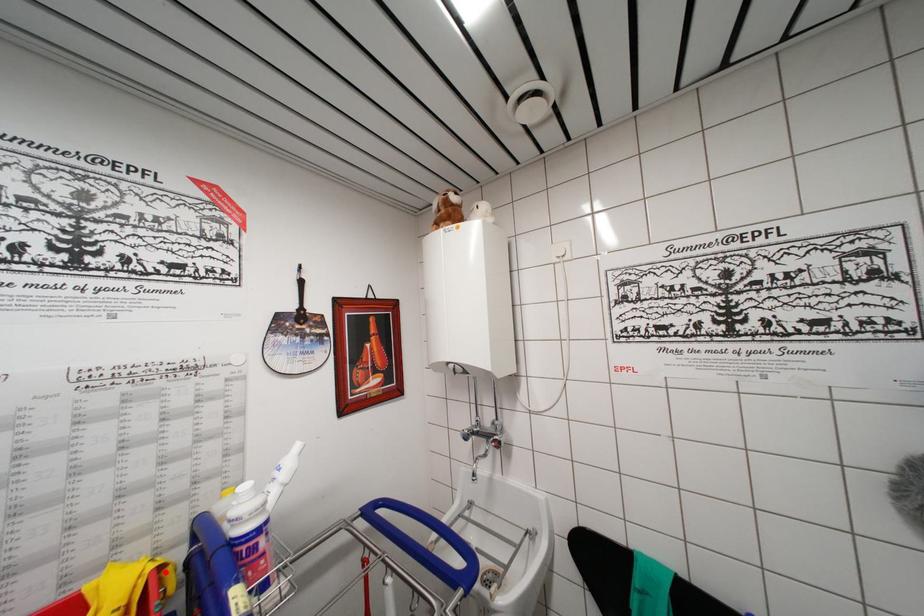
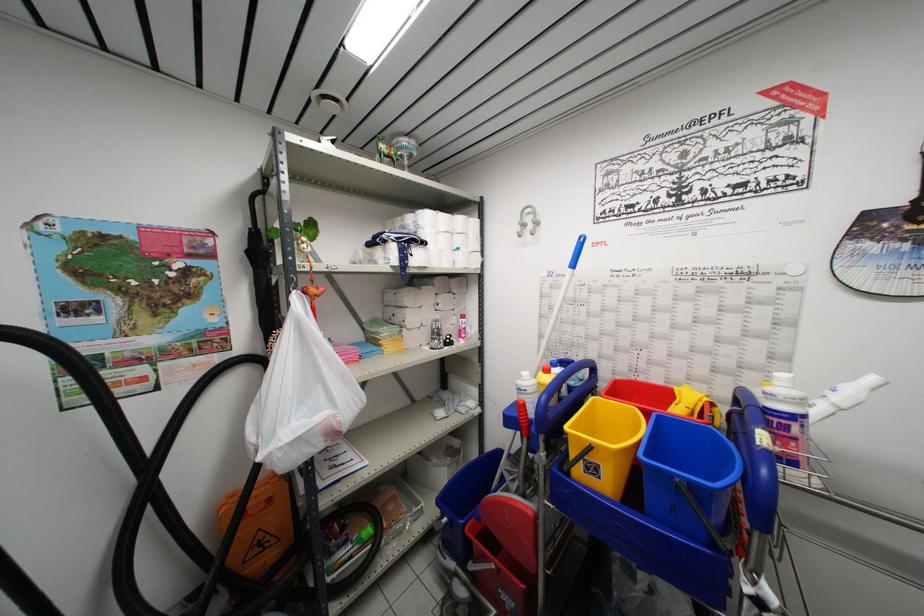
Find the pixel in the second image that matches the highlighted location in the first image.

(715, 408)